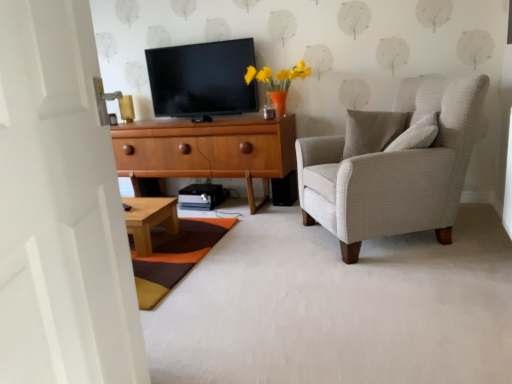
What are the coordinates of `vacant space that is to the left of light gray fabric armchair at right` in the screenshot? It's located at (263, 250).